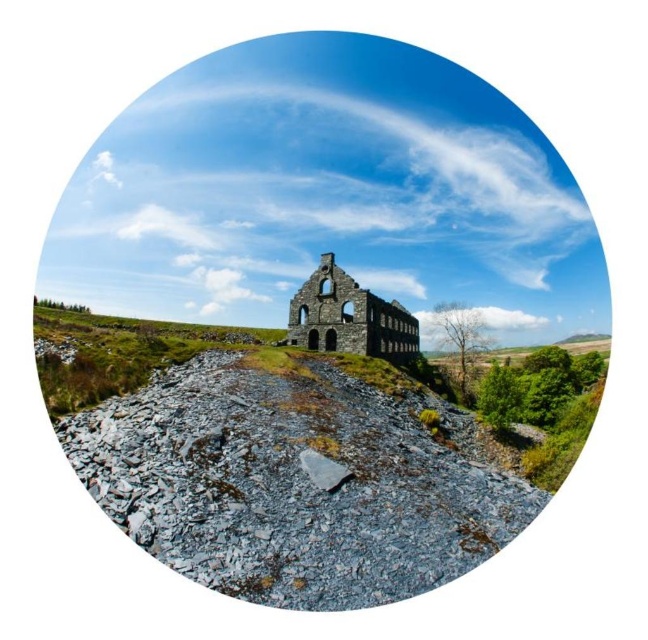
Which is below, gray rock at center or brown stone church at center?

gray rock at center is below.

Which of these two, gray rock at center or brown stone church at center, stands taller?

brown stone church at center

Does point (426, 404) come farther from viewer compared to point (364, 321)?

No.

This screenshot has height=640, width=648. Identify the location of gray rock at center. (294, 483).

Is brown stone church at center shorter than gray rough stone at lower center?

Incorrect, brown stone church at center's height does not fall short of gray rough stone at lower center's.

Between brown stone church at center and gray rough stone at lower center, which one has less height?

gray rough stone at lower center is shorter.

Locate an element on the screen. Image resolution: width=648 pixels, height=640 pixels. brown stone church at center is located at coordinates 349,317.

Is gray rock at center above gray rough stone at lower center?

Actually, gray rock at center is below gray rough stone at lower center.

Who is more distant from viewer, (283, 422) or (325, 464)?

The point (283, 422) is more distant.

Between point (384, 563) and point (347, 468), which one is positioned in front?

Point (384, 563) is in front.

Locate an element on the screen. gray rock at center is located at coordinates (294, 483).